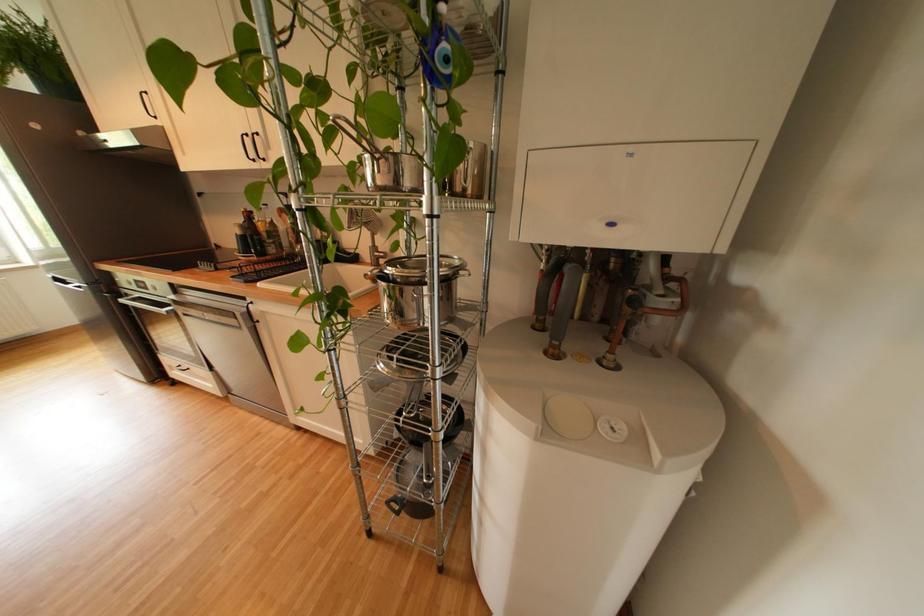
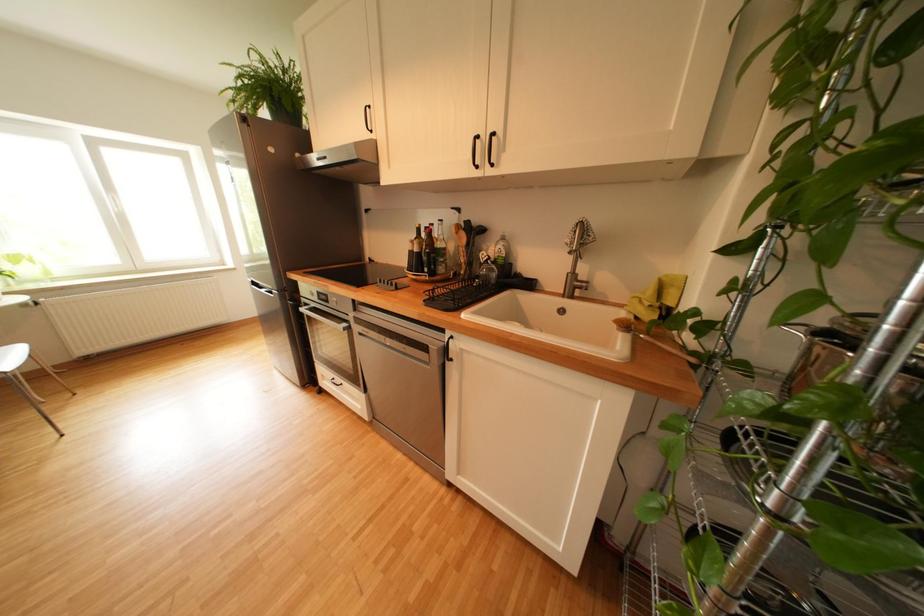
What movement of the cameraman would produce the second image?

The movement direction of the cameraman is left, forward.